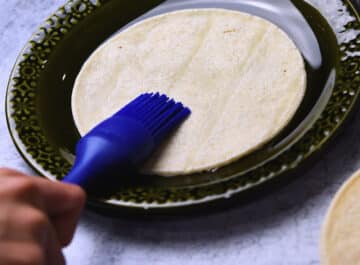
What are the coordinates of `kitchen utensil` in the screenshot? It's located at (115, 153).